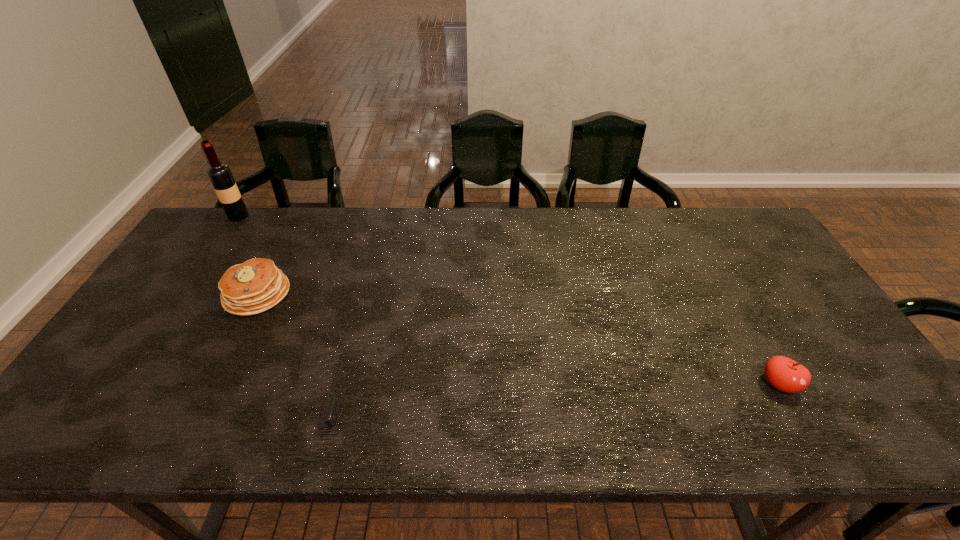
Locate which object is the closest to the farthest object. Please provide its 2D coordinates. Your answer should be formatted as a tuple, i.e. [(x, y)], where the tuple contains the x and y coordinates of a point satisfying the conditions above.

[(257, 285)]

This screenshot has height=540, width=960. In order to click on vacant region that satisfies the following two spatial constraints: 1. on the front side of the third object from right to left; 2. on the left side of the apple in this screenshot , I will do [x=211, y=384].